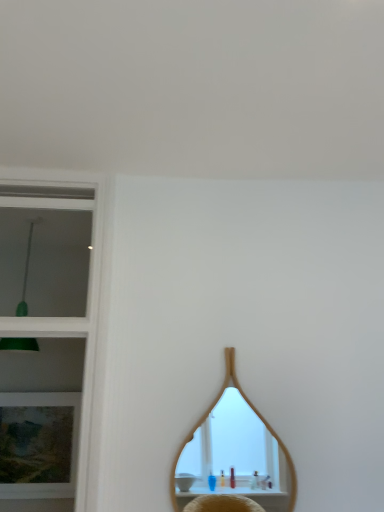
Question: From a real-world perspective, relative to wooden mirror at center, is matte wooden picture frame at left vertically above or below?

Choices:
 (A) above
 (B) below

Answer: (B)

Question: Based on their positions, is matte wooden picture frame at left located to the left or right of wooden mirror at center?

Choices:
 (A) left
 (B) right

Answer: (A)

Question: Considering the positions of point (49, 473) and point (246, 458), is point (49, 473) closer or farther from the camera than point (246, 458)?

Choices:
 (A) closer
 (B) farther

Answer: (A)

Question: Looking at the image, does wooden mirror at center seem bigger or smaller compared to matte wooden picture frame at left?

Choices:
 (A) big
 (B) small

Answer: (B)

Question: Considering their positions, is wooden mirror at center located in front of or behind matte wooden picture frame at left?

Choices:
 (A) front
 (B) behind

Answer: (A)

Question: Do you think wooden mirror at center is within matte wooden picture frame at left, or outside of it?

Choices:
 (A) outside
 (B) inside

Answer: (A)

Question: Considering the positions of point (226, 408) and point (56, 415), is point (226, 408) closer or farther from the camera than point (56, 415)?

Choices:
 (A) closer
 (B) farther

Answer: (B)